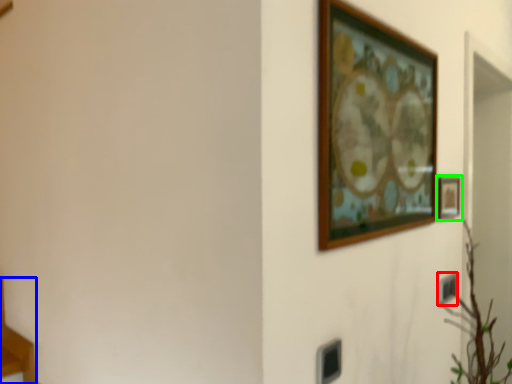
Question: Based on their relative distances, which object is farther from electric outlet (highlighted by a red box)? Choose from furniture (highlighted by a blue box) and picture frame (highlighted by a green box).

Choices:
 (A) furniture
 (B) picture frame

Answer: (A)